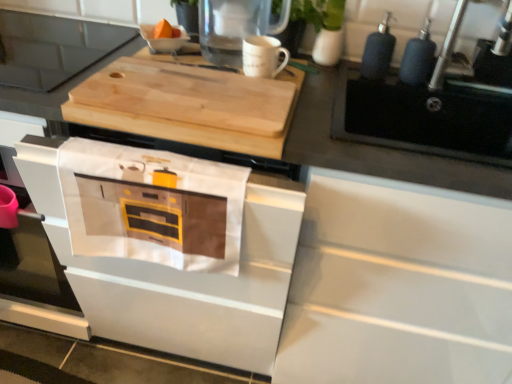
Question: From the image's perspective, is white cotton towel at lower center above or below wooden cutting board at upper center?

Choices:
 (A) above
 (B) below

Answer: (B)

Question: Does point (128, 256) appear closer or farther from the camera than point (10, 57)?

Choices:
 (A) farther
 (B) closer

Answer: (B)

Question: Estimate the real-world distances between objects in this image. Which object is closer to the clear glass pitcher at upper center?

Choices:
 (A) white matte oven at center
 (B) wooden cutting board at upper center
 (C) metallic silver faucet at upper right
 (D) natural wood cutting board at upper center
 (E) white cotton towel at lower center

Answer: (D)

Question: Which is nearer to the clear glass pitcher at upper center?

Choices:
 (A) white matte oven at center
 (B) metallic silver faucet at upper right
 (C) wooden cutting board at upper center
 (D) white cotton towel at lower center
 (E) natural wood cutting board at upper center

Answer: (E)